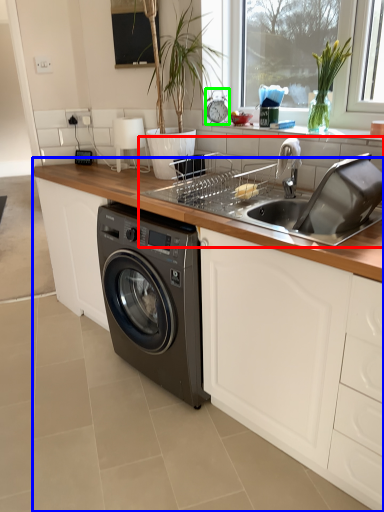
Question: Which is farther away from sink (highlighted by a red box)? countertop (highlighted by a blue box) or appliance (highlighted by a green box)?

Choices:
 (A) countertop
 (B) appliance

Answer: (B)